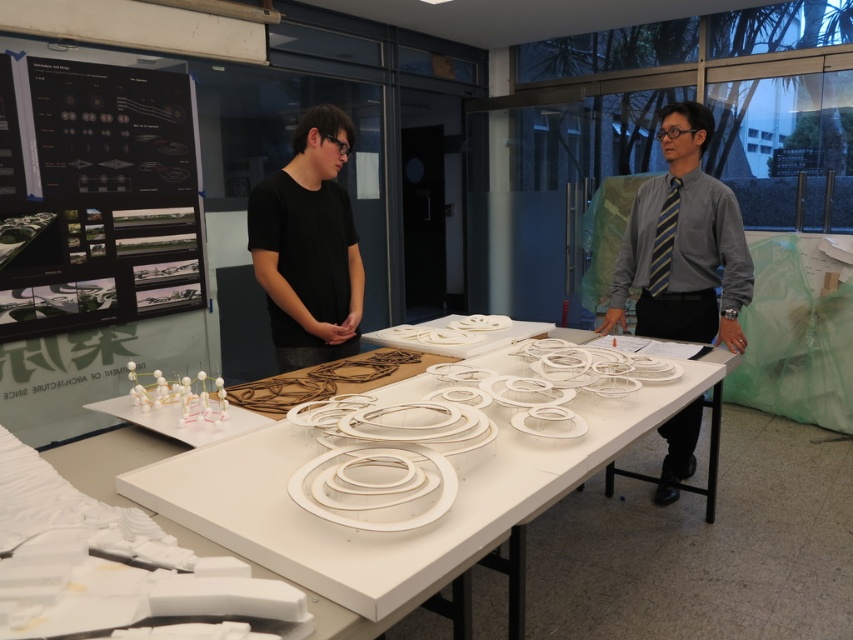
Question: Can you confirm if gray shirt and tie at center is bigger than black matte shirt at center?

Choices:
 (A) yes
 (B) no

Answer: (A)

Question: Which point appears farthest from the camera in this image?

Choices:
 (A) (663, 467)
 (B) (302, 161)
 (C) (355, 566)

Answer: (A)

Question: Considering the real-world distances, which object is farthest from the gray shirt and tie at center?

Choices:
 (A) white matte sculpture at center
 (B) black matte shirt at center

Answer: (B)

Question: Is gray shirt and tie at center closer to camera compared to black matte shirt at center?

Choices:
 (A) yes
 (B) no

Answer: (B)

Question: Is white matte sculpture at center to the left of gray shirt and tie at center from the viewer's perspective?

Choices:
 (A) no
 (B) yes

Answer: (B)

Question: Which point is farther to the camera?

Choices:
 (A) (251, 253)
 (B) (152, 488)
 (C) (703, 195)

Answer: (C)